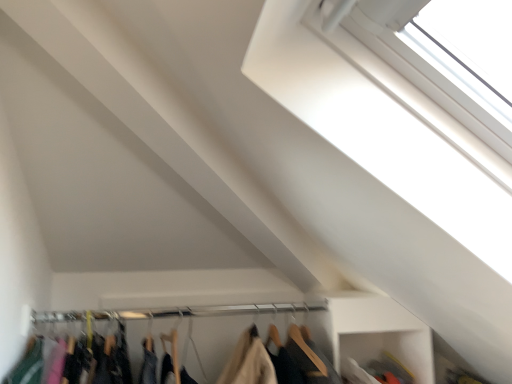
Question: From a real-world perspective, is wooden hangers at lower center beneath metallic silver clothesline at center?

Choices:
 (A) no
 (B) yes

Answer: (B)

Question: From the image's perspective, is wooden hangers at lower center located beneath metallic silver clothesline at center?

Choices:
 (A) no
 (B) yes

Answer: (B)

Question: Is wooden hangers at lower center looking in the opposite direction of metallic silver clothesline at center?

Choices:
 (A) no
 (B) yes

Answer: (A)

Question: Is wooden hangers at lower center oriented towards metallic silver clothesline at center?

Choices:
 (A) yes
 (B) no

Answer: (B)

Question: Does wooden hangers at lower center have a lesser height compared to metallic silver clothesline at center?

Choices:
 (A) yes
 (B) no

Answer: (B)

Question: Considering the positions of point (40, 312) and point (33, 319), is point (40, 312) closer or farther from the camera than point (33, 319)?

Choices:
 (A) farther
 (B) closer

Answer: (A)

Question: Based on their sizes in the image, would you say metallic silver clothesline at center is bigger or smaller than wooden hangers at lower center?

Choices:
 (A) small
 (B) big

Answer: (A)

Question: Is metallic silver clothesline at center taller or shorter than wooden hangers at lower center?

Choices:
 (A) short
 (B) tall

Answer: (A)

Question: Considering their positions, is metallic silver clothesline at center located in front of or behind wooden hangers at lower center?

Choices:
 (A) front
 (B) behind

Answer: (B)

Question: Is white plastic window at upper right taller or shorter than metallic silver clothesline at center?

Choices:
 (A) short
 (B) tall

Answer: (B)

Question: Considering the positions of point (407, 105) and point (262, 309), is point (407, 105) closer or farther from the camera than point (262, 309)?

Choices:
 (A) farther
 (B) closer

Answer: (B)

Question: In terms of size, does white plastic window at upper right appear bigger or smaller than metallic silver clothesline at center?

Choices:
 (A) big
 (B) small

Answer: (A)

Question: Is white plastic window at upper right inside the boundaries of metallic silver clothesline at center, or outside?

Choices:
 (A) inside
 (B) outside

Answer: (B)

Question: Is wooden hangers at lower center in front of or behind white plastic window at upper right in the image?

Choices:
 (A) behind
 (B) front

Answer: (A)

Question: Is point (126, 319) positioned closer to the camera than point (323, 94)?

Choices:
 (A) closer
 (B) farther

Answer: (B)